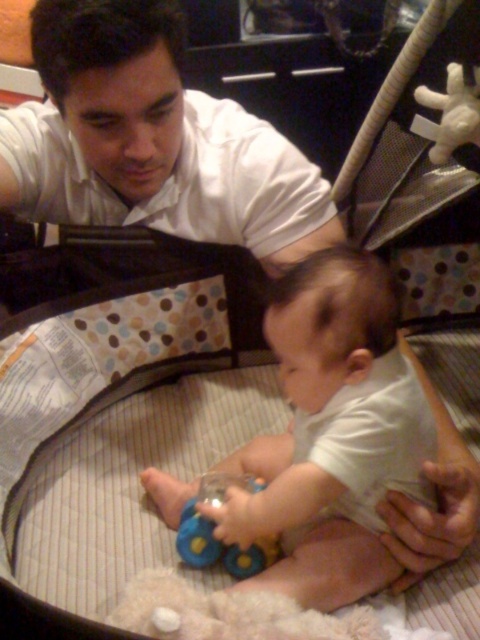
Question: Based on their relative distances, which object is farther from the white smooth shirt at upper left?

Choices:
 (A) blue rubber toy at center
 (B) white matte baby at center

Answer: (A)

Question: Can you confirm if white smooth shirt at upper left is positioned to the left of blue rubber toy at center?

Choices:
 (A) yes
 (B) no

Answer: (A)

Question: Does white smooth shirt at upper left appear over blue rubber toy at center?

Choices:
 (A) no
 (B) yes

Answer: (B)

Question: Does white smooth shirt at upper left come in front of blue rubber toy at center?

Choices:
 (A) no
 (B) yes

Answer: (B)

Question: Based on their relative distances, which object is nearer to the white smooth shirt at upper left?

Choices:
 (A) blue rubber toy at center
 (B) white matte baby at center

Answer: (B)

Question: Which point appears farthest from the camera in this image?

Choices:
 (A) (44, 33)
 (B) (202, 499)

Answer: (B)